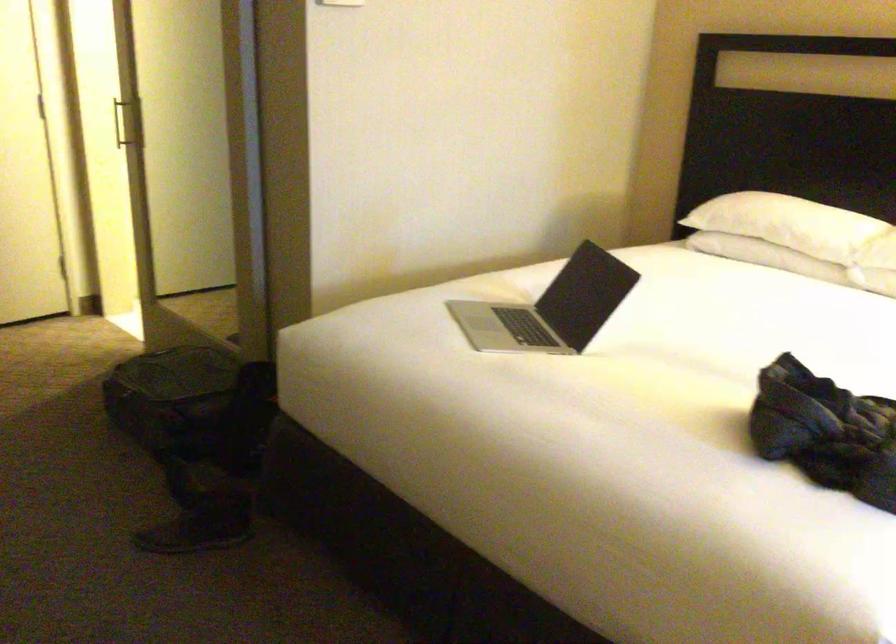
Find where to push the white light switch. Please return your answer as a coordinate pair (x, y).

(323, 3)